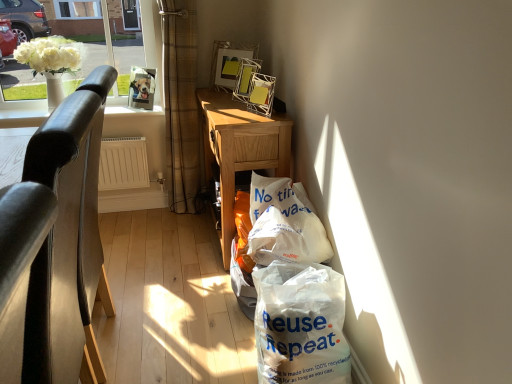
This screenshot has width=512, height=384. Find the location of `free space behind black leather chair at left`. free space behind black leather chair at left is located at coordinates (146, 280).